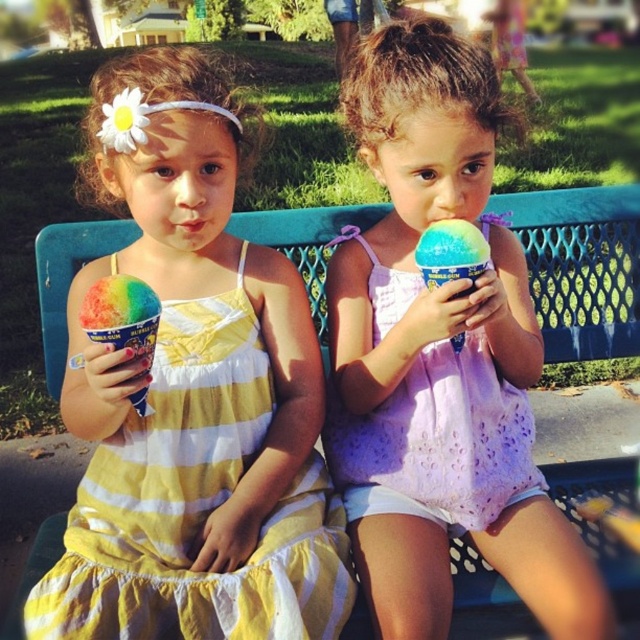
Is pastel purple fabric dress at center wider than lavender sheer top at center?

Indeed, pastel purple fabric dress at center has a greater width compared to lavender sheer top at center.

Does pastel purple fabric dress at center appear on the right side of lavender sheer top at center?

Yes, pastel purple fabric dress at center is to the right of lavender sheer top at center.

Which is behind, point (369, 152) or point (355, 458)?

The point (355, 458) is more distant.

Where is `pastel purple fabric dress at center`? This screenshot has width=640, height=640. pastel purple fabric dress at center is located at coordinates (440, 356).

Is point (401, 486) less distant than point (458, 276)?

That is False.

Is lavender sheer top at center bigger than pastel rainbow ice cream at center?

Yes, lavender sheer top at center is bigger than pastel rainbow ice cream at center.

Which is in front, point (392, 403) or point (451, 262)?

Point (451, 262)

The width and height of the screenshot is (640, 640). What are the coordinates of `lavender sheer top at center` in the screenshot? It's located at (438, 440).

Which is above, pastel purple fabric dress at center or yellow striped fabric dress at left?

pastel purple fabric dress at center is above.

The image size is (640, 640). What are the coordinates of `pastel purple fabric dress at center` in the screenshot? It's located at (440, 356).

Is point (508, 483) in front of point (332, 528)?

No.

Find the location of `pastel purple fabric dress at center`. pastel purple fabric dress at center is located at coordinates (440, 356).